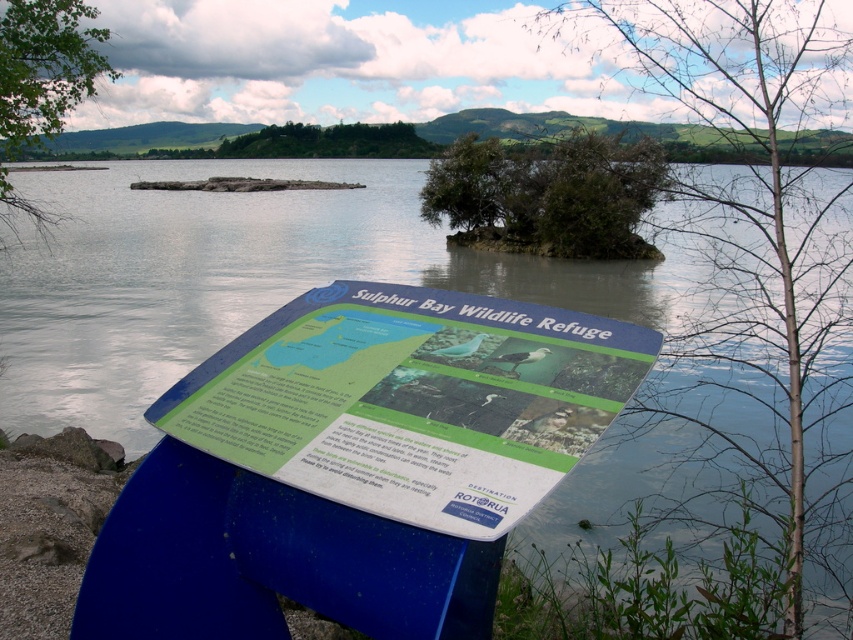
You are standing in front of the signboard at Sulphur Bay Wildlife Refuge. You notice a green leafy tree at center and a green leafy bush at center. Which one is positioned to the left of the other?

The green leafy tree at center is positioned to the left of the green leafy bush at center.

You are standing at the signboard in the foreground of the Sulphur Bay Wildlife Refuge scene. You notice a green leafy tree at center and a green leafy bush at center. Which of these two plants has a smaller width?

The green leafy tree at center has a lesser width compared to the green leafy bush at center.

Looking at this image, you are standing at the signboard in the foreground of the Sulphur Bay Wildlife Refuge scene. You want to locate the green leafy tree at center. According to the coordinates provided, in which direction should you look to find it?

The green leafy tree at center is located at coordinates point (759, 237). Since the y coordinate is 0.892, which is closer to 1, you should look downward to find the green leafy tree at center.